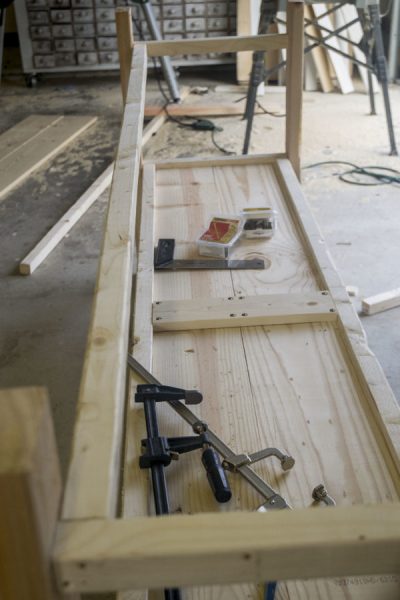
Image resolution: width=400 pixels, height=600 pixels. In order to click on unfinished wood furniture in this screenshot , I will do `click(231, 350)`, `click(196, 184)`, `click(124, 176)`, `click(247, 540)`, `click(313, 223)`.